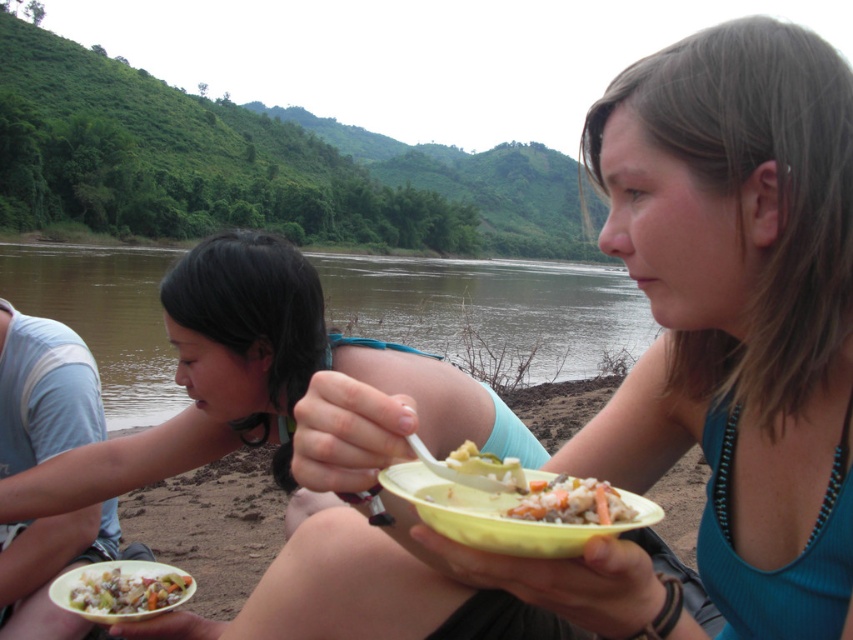
From the picture: You are planning to place the shiny plastic bowl at lower left on the edge of the brown water at river left. Based on their heights, will the bowl fit stably on the water edge without tipping over?

The brown water at river left has a greater height compared to the shiny plastic bowl at lower left, so the bowl will fit stably on the water edge without tipping over.

Looking at this image, you are a photographer standing at the center of the scene. You want to take a photo of the shiny plastic bowl at lower left and the brown water at river left. Which object should you adjust your camera focus to first to ensure both are in focus?

The brown water at river left is further to the viewer than the shiny plastic bowl at lower left, so you should focus on the brown water at river left first to ensure both objects are in focus.

You are a photographer standing at the riverbank and want to take a photo of the two yellow bowls. Which bowl should you focus on first if you need to capture the matte yellow bowl at center before the yellow plastic bowl at center?

The matte yellow bowl at center is positioned on the right side of yellow plastic bowl at center, so you should focus on the yellow plastic bowl at center first to capture them in order from left to right.